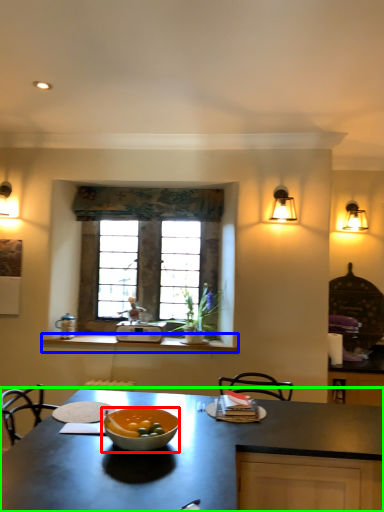
Question: Which object is the closest to the bowl (highlighted by a red box)? Choose among these: counter (highlighted by a blue box) or countertop (highlighted by a green box).

Choices:
 (A) counter
 (B) countertop

Answer: (B)